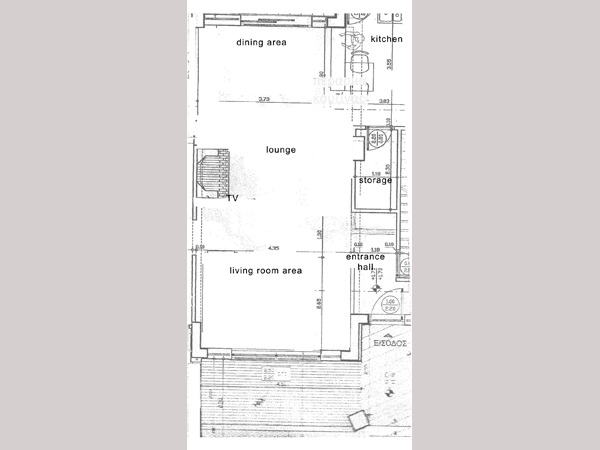
The image size is (600, 450). I want to click on dining, so click(x=247, y=43).